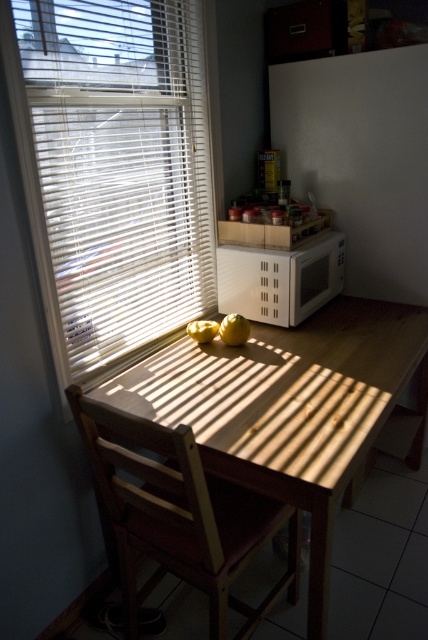
Question: Is wooden table at center below white matte microwave at right?

Choices:
 (A) no
 (B) yes

Answer: (B)

Question: Estimate the real-world distances between objects in this image. Which object is farther from the yellow matte apple at center?

Choices:
 (A) yellow matte pear at center
 (B) wooden chair at lower left
 (C) white plastic blinds at upper left

Answer: (B)

Question: Is wooden chair at lower left wider than white matte microwave at right?

Choices:
 (A) yes
 (B) no

Answer: (A)

Question: Which point is farther from the camera taking this photo?

Choices:
 (A) (362, 387)
 (B) (273, 300)
 (C) (139, 20)

Answer: (B)

Question: Considering the real-world distances, which object is farthest from the yellow matte pear at center?

Choices:
 (A) wooden chair at lower left
 (B) white matte microwave at right
 (C) yellow matte apple at center
 (D) wooden table at center

Answer: (A)

Question: From the image, what is the correct spatial relationship of wooden table at center in relation to yellow matte pear at center?

Choices:
 (A) below
 (B) above

Answer: (A)